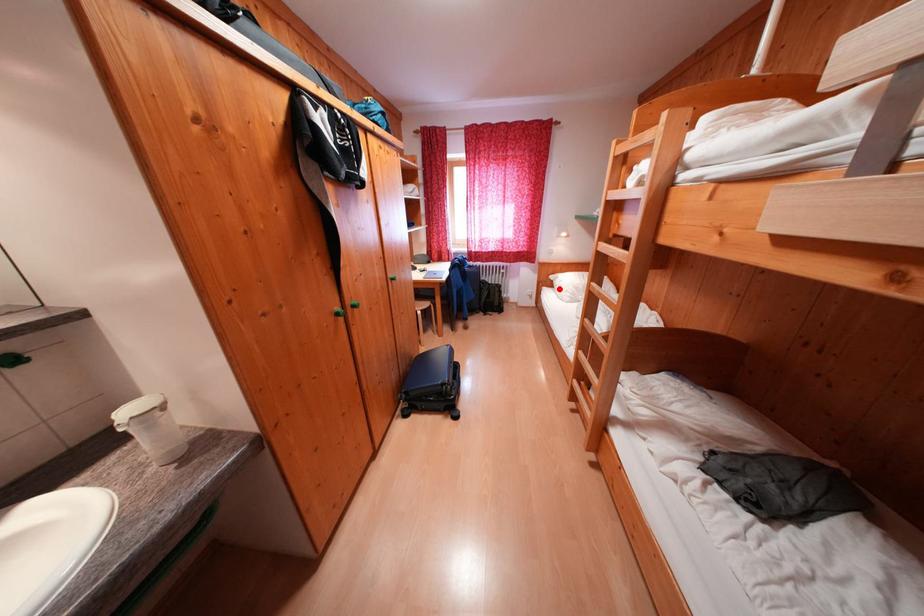
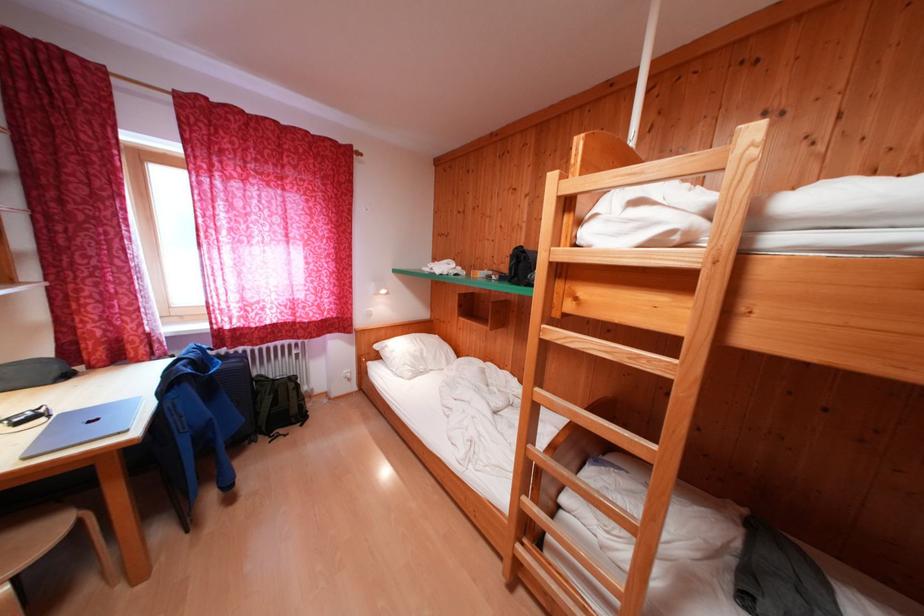
Where in the second image is the point corresponding to the highlighted location from the first image?

(385, 361)